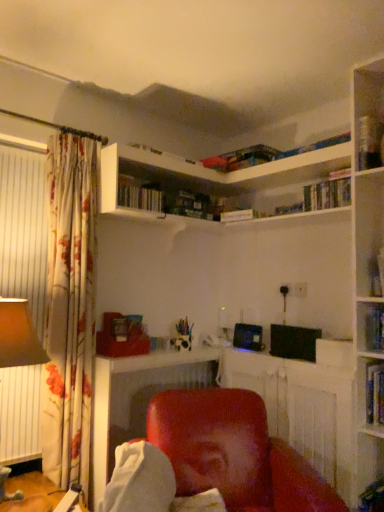
Question: Should I look upward or downward to see matte brown lampshade at left?

Choices:
 (A) down
 (B) up

Answer: (A)

Question: Is hardcover book at upper right, which ranks as the fourth book in bottom-to-top order, closer to the viewer compared to hardcover book at upper right, the 4th book in the left-to-right sequence?

Choices:
 (A) no
 (B) yes

Answer: (A)

Question: Does hardcover book at upper right, acting as the first book starting from the top, turn towards hardcover book at upper right, the 1th book from the right?

Choices:
 (A) no
 (B) yes

Answer: (A)

Question: Is hardcover book at upper right, which ranks as the fourth book in bottom-to-top order, in contact with hardcover book at upper right, the 4th book in the left-to-right sequence?

Choices:
 (A) no
 (B) yes

Answer: (A)

Question: Considering the relative sizes of hardcover book at upper right, acting as the first book starting from the top, and hardcover book at upper right, the 4th book in the left-to-right sequence, in the image provided, is hardcover book at upper right, acting as the first book starting from the top, taller than hardcover book at upper right, the 4th book in the left-to-right sequence,?

Choices:
 (A) yes
 (B) no

Answer: (A)

Question: From the image's perspective, is hardcover book at upper right, the second book in the right-to-left sequence, located above hardcover book at upper right, the fourth book when ordered from top to bottom?

Choices:
 (A) no
 (B) yes

Answer: (B)

Question: From a real-world perspective, is hardcover book at upper right, the third book from the left, below hardcover book at upper right, the 1th book from the right?

Choices:
 (A) yes
 (B) no

Answer: (B)

Question: From a real-world perspective, is matte red chair at center over matte brown lampshade at left?

Choices:
 (A) yes
 (B) no

Answer: (B)

Question: From the image's perspective, would you say matte red chair at center is positioned over matte brown lampshade at left?

Choices:
 (A) no
 (B) yes

Answer: (A)

Question: Is matte red chair at center smaller than matte brown lampshade at left?

Choices:
 (A) no
 (B) yes

Answer: (A)

Question: Does matte red chair at center have a lesser height compared to matte brown lampshade at left?

Choices:
 (A) yes
 (B) no

Answer: (A)

Question: Can we say matte red chair at center lies outside matte brown lampshade at left?

Choices:
 (A) no
 (B) yes

Answer: (B)

Question: Is matte red chair at center bigger than matte brown lampshade at left?

Choices:
 (A) yes
 (B) no

Answer: (A)

Question: From the image's perspective, would you say matte red chair at center is positioned over matte red chair at lower center?

Choices:
 (A) no
 (B) yes

Answer: (B)